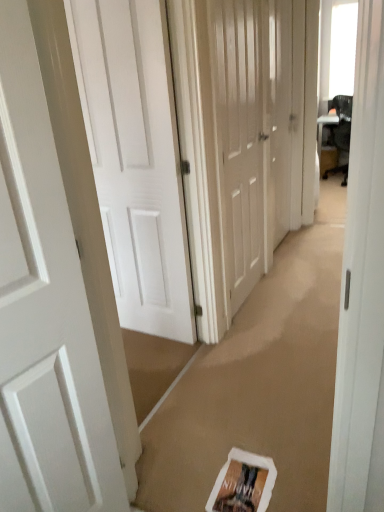
Question: Would you say white matte door at center, which is the 3th door in right-to-left order, is inside or outside white glossy door at center, acting as the fourth door starting from the left?

Choices:
 (A) inside
 (B) outside

Answer: (B)

Question: Considering the relative positions of white matte door at center, arranged as the 2th door when viewed from the left, and white glossy door at center, positioned as the 1th door in right-to-left order, in the image provided, is white matte door at center, arranged as the 2th door when viewed from the left, to the left or to the right of white glossy door at center, positioned as the 1th door in right-to-left order,?

Choices:
 (A) right
 (B) left

Answer: (B)

Question: Considering the real-world distances, which object is closest to the white matte door at center, which is the 3th door in right-to-left order?

Choices:
 (A) white matte door at left, the fourth door positioned from the right
 (B) white glossy door at center, positioned as the 1th door in right-to-left order
 (C) white matte door at center, positioned as the 3th door in left-to-right order

Answer: (C)

Question: Which object is the farthest from the white matte door at center, positioned as the 3th door in left-to-right order?

Choices:
 (A) white matte door at center, arranged as the 2th door when viewed from the left
 (B) white glossy door at center, acting as the fourth door starting from the left
 (C) white matte door at left, the fourth door positioned from the right

Answer: (C)